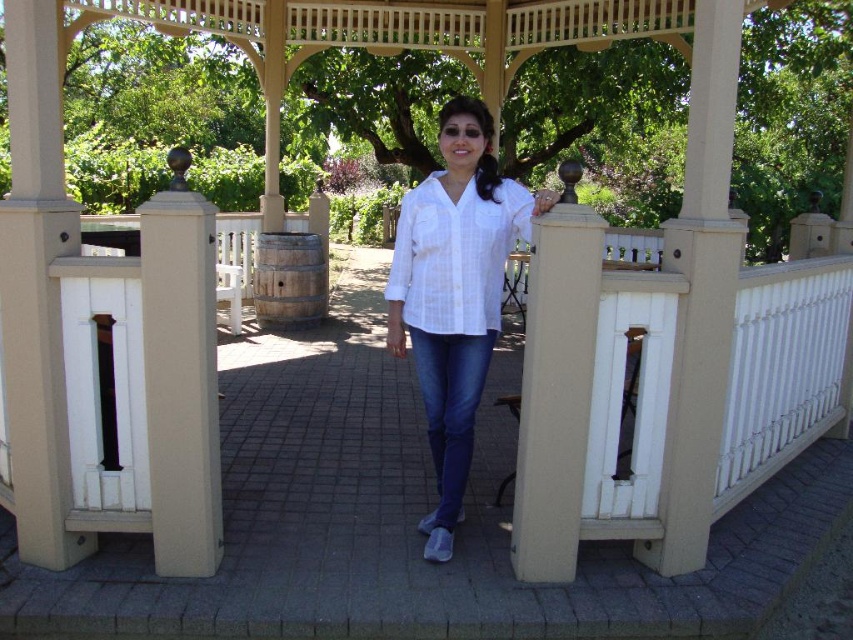
Question: Which point is farther from the camera taking this photo?

Choices:
 (A) (471, 236)
 (B) (550, 458)

Answer: (A)

Question: From the image, what is the correct spatial relationship of white woven blouse at center in relation to beige smooth post at center?

Choices:
 (A) below
 (B) above

Answer: (B)

Question: Can you confirm if white woven blouse at center is smaller than beige concrete post at center?

Choices:
 (A) no
 (B) yes

Answer: (A)

Question: Among these points, which one is farthest from the camera?

Choices:
 (A) (425, 282)
 (B) (178, 406)
 (C) (463, 376)
 (D) (524, 221)

Answer: (A)

Question: Which object is closer to the camera taking this photo?

Choices:
 (A) white woven blouse at center
 (B) beige concrete post at center
 (C) white textured shirt at center

Answer: (B)

Question: Can you confirm if white woven blouse at center is positioned to the left of beige concrete post at center?

Choices:
 (A) yes
 (B) no

Answer: (A)